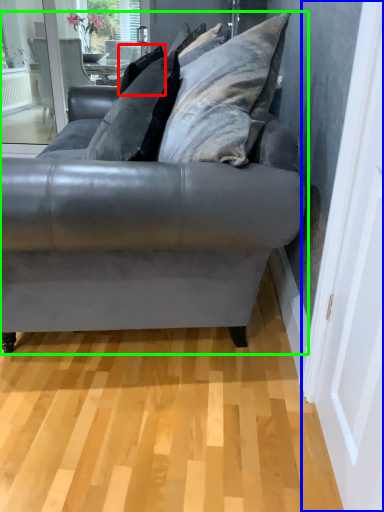
Question: Estimate the real-world distances between objects in this image. Which object is farther from pillow (highlighted by a red box), screen door (highlighted by a blue box) or studio couch (highlighted by a green box)?

Choices:
 (A) screen door
 (B) studio couch

Answer: (A)